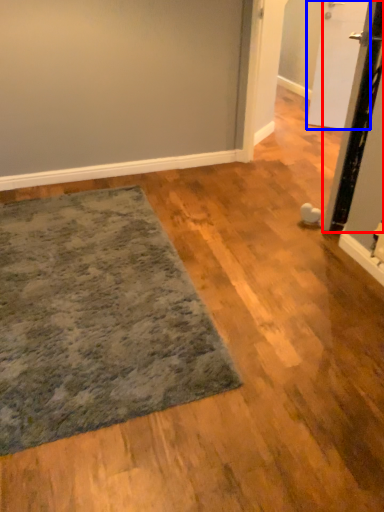
Question: Which of the following is the farthest to the observer, door (highlighted by a red box) or door (highlighted by a blue box)?

Choices:
 (A) door
 (B) door

Answer: (B)